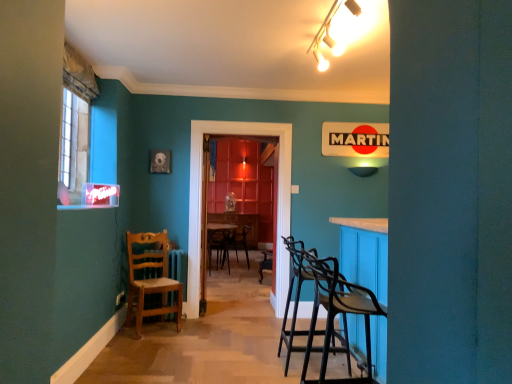
Question: Does white glossy track light at upper center have a smaller size compared to wooden chair at left?

Choices:
 (A) yes
 (B) no

Answer: (A)

Question: Would you say white glossy track light at upper center contains wooden chair at left?

Choices:
 (A) no
 (B) yes

Answer: (A)

Question: Is white glossy track light at upper center far from wooden chair at left?

Choices:
 (A) no
 (B) yes

Answer: (B)

Question: Does white glossy track light at upper center have a lesser width compared to wooden chair at left?

Choices:
 (A) yes
 (B) no

Answer: (B)

Question: From the image's perspective, is white glossy track light at upper center on top of wooden chair at left?

Choices:
 (A) yes
 (B) no

Answer: (A)

Question: Is white glossy track light at upper center completely or partially outside of wooden chair at left?

Choices:
 (A) no
 (B) yes

Answer: (B)

Question: Is matte plastic power outlet at lower left not close to matte white lampshade at upper right?

Choices:
 (A) no
 (B) yes

Answer: (B)

Question: Does matte plastic power outlet at lower left have a lesser width compared to matte white lampshade at upper right?

Choices:
 (A) no
 (B) yes

Answer: (B)

Question: Does matte plastic power outlet at lower left have a smaller size compared to matte white lampshade at upper right?

Choices:
 (A) yes
 (B) no

Answer: (A)

Question: Does matte plastic power outlet at lower left have a lesser height compared to matte white lampshade at upper right?

Choices:
 (A) yes
 (B) no

Answer: (A)

Question: Is matte plastic power outlet at lower left taller than matte white lampshade at upper right?

Choices:
 (A) yes
 (B) no

Answer: (B)

Question: Considering the relative positions of matte plastic power outlet at lower left and matte white lampshade at upper right in the image provided, is matte plastic power outlet at lower left to the left of matte white lampshade at upper right from the viewer's perspective?

Choices:
 (A) no
 (B) yes

Answer: (B)

Question: Is wooden picture frame at upper left facing away from white glossy track light at upper center?

Choices:
 (A) yes
 (B) no

Answer: (B)